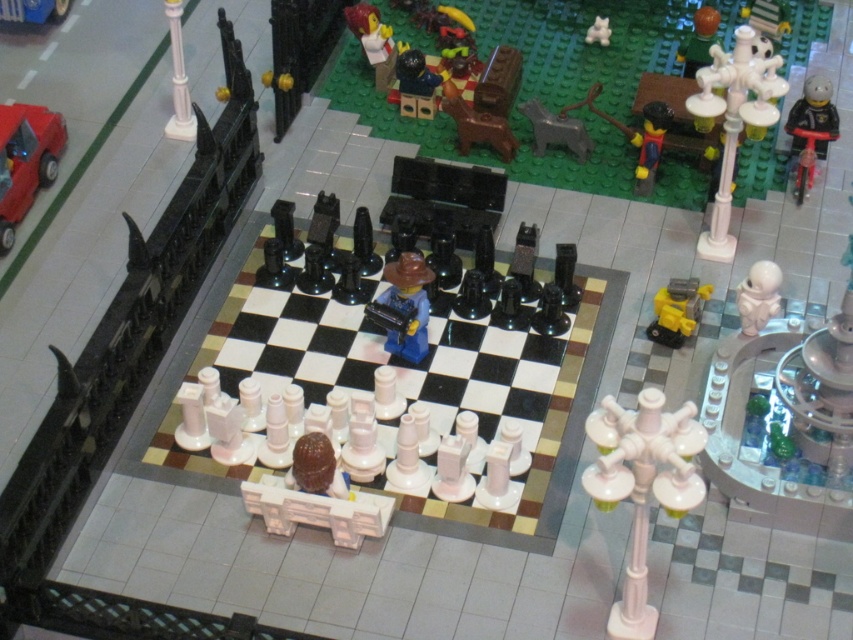
Is point (346, 516) closer to camera compared to point (809, 154)?

That is True.

Is brown matte egg at center to the right of black plastic toy at upper right from the viewer's perspective?

Incorrect, brown matte egg at center is not on the right side of black plastic toy at upper right.

Between point (376, 532) and point (833, 118), which one is positioned in front?

Point (376, 532)

This screenshot has height=640, width=853. I want to click on brown matte egg at center, so click(317, 497).

Is shiny red car at left shorter than black plastic toy at upper right?

No, shiny red car at left is not shorter than black plastic toy at upper right.

Is shiny red car at left to the left of black plastic toy at upper right from the viewer's perspective?

Correct, you'll find shiny red car at left to the left of black plastic toy at upper right.

This screenshot has height=640, width=853. Describe the element at coordinates (26, 161) in the screenshot. I see `shiny red car at left` at that location.

Locate an element on the screen. This screenshot has width=853, height=640. shiny red car at left is located at coordinates (26, 161).

Does shiny red car at left have a greater height compared to white plastic figure at center-right?

Yes, shiny red car at left is taller than white plastic figure at center-right.

Does shiny red car at left have a lesser width compared to white plastic figure at center-right?

Incorrect, shiny red car at left's width is not less than white plastic figure at center-right's.

Is point (25, 156) behind point (750, 292)?

Yes, point (25, 156) is behind point (750, 292).

At what (x,y) coordinates should I click in order to perform the action: click on shiny red car at left. Please return your answer as a coordinate pair (x, y). This screenshot has width=853, height=640. Looking at the image, I should click on (26, 161).